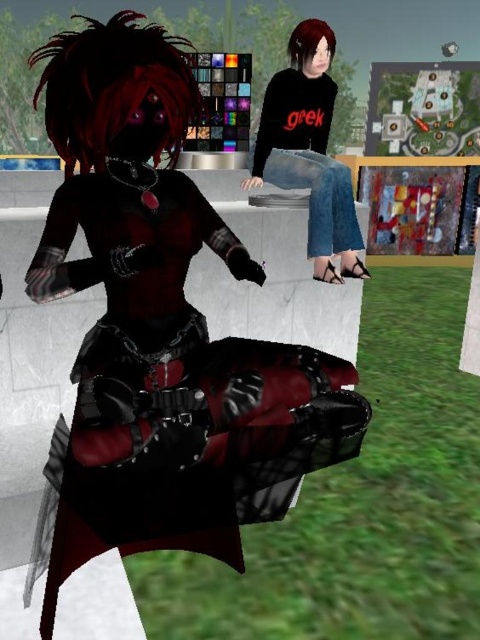
You are a game developer designing a virtual environment. You need to place a new decorative object between the matte black armor at center and the denim jeans at center. Considering their sizes, which object should the new item be placed closer to?

The matte black armor at center is bigger than the denim jeans at center, so the new decorative object should be placed closer to the denim jeans at center to maintain balance in the scene.